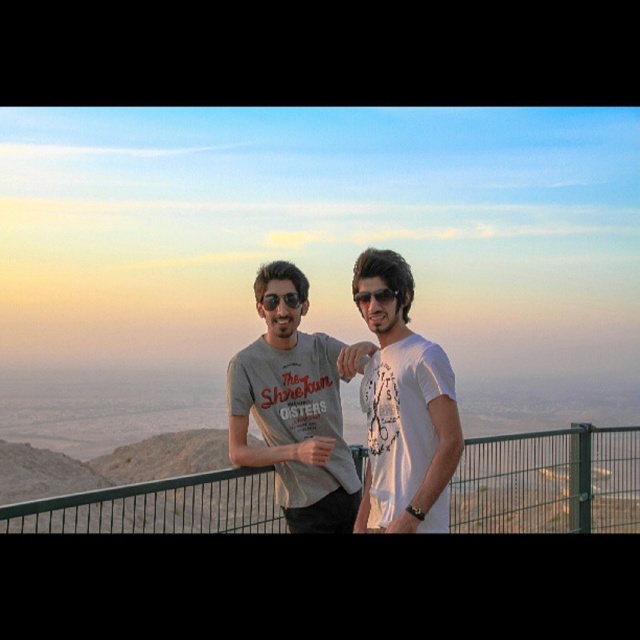
Question: Which of these objects is positioned farthest from the white matte t-shirt at center?

Choices:
 (A) matte gray t-shirt at center
 (B) matte black sunglasses at center
 (C) green metal fence at center

Answer: (C)

Question: Which point is farther from the camera taking this photo?

Choices:
 (A) (268, 305)
 (B) (509, 481)
 (C) (445, 420)

Answer: (B)

Question: Is green metal fence at center wider than white matte t-shirt at center?

Choices:
 (A) no
 (B) yes

Answer: (B)

Question: Estimate the real-world distances between objects in this image. Which object is farther from the white matte t-shirt at center?

Choices:
 (A) matte black sunglasses at center
 (B) matte gray t-shirt at center

Answer: (A)

Question: Is matte gray t-shirt at center bigger than white matte t-shirt at center?

Choices:
 (A) no
 (B) yes

Answer: (B)

Question: Does matte gray t-shirt at center have a larger size compared to green metal fence at center?

Choices:
 (A) no
 (B) yes

Answer: (A)